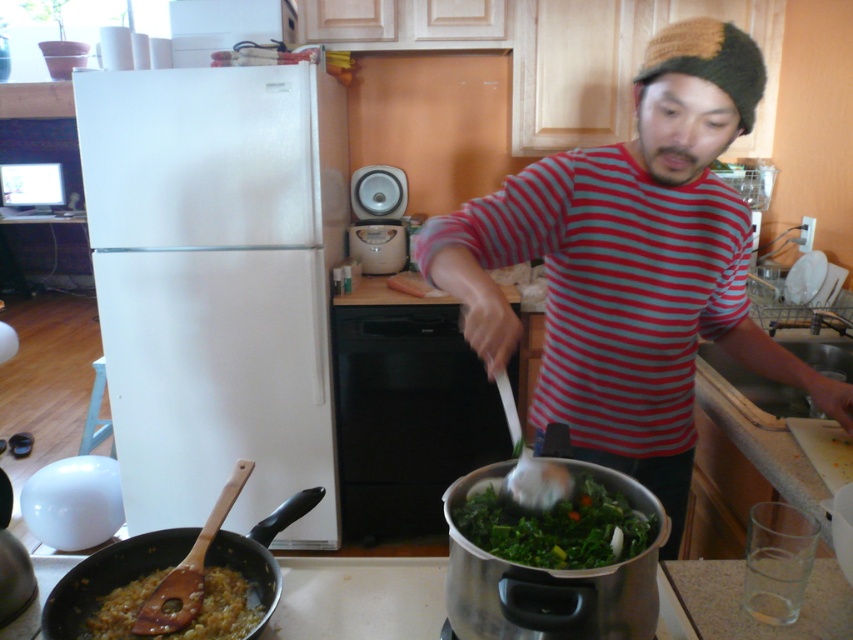
Is point (558, 554) less distant than point (225, 612)?

Yes.

Does green leafy vegetables at center appear on the left side of brown matte wooden spoon at lower left?

No, green leafy vegetables at center is not to the left of brown matte wooden spoon at lower left.

Who is more forward, [543,534] or [202,634]?

Point [543,534] is in front.

The image size is (853, 640). I want to click on green leafy vegetables at center, so click(x=556, y=525).

Is striped cotton shirt at center below stainless steel wok at lower center?

No.

Is the position of striped cotton shirt at center less distant than that of stainless steel wok at lower center?

No, striped cotton shirt at center is further to the viewer.

Does point (583, 397) come behind point (479, 476)?

Yes, it is behind point (479, 476).

The height and width of the screenshot is (640, 853). What are the coordinates of `striped cotton shirt at center` in the screenshot? It's located at (630, 268).

Between stainless steel wok at lower center and woodenwoodenwok at lower left, which one has less height?

Standing shorter between the two is woodenwoodenwok at lower left.

Can you confirm if stainless steel wok at lower center is positioned above woodenwoodenwok at lower left?

Correct, stainless steel wok at lower center is located above woodenwoodenwok at lower left.

Does point (515, 580) come closer to viewer compared to point (265, 620)?

Yes, point (515, 580) is in front of point (265, 620).

Locate an element on the screen. The height and width of the screenshot is (640, 853). stainless steel wok at lower center is located at coordinates (550, 577).